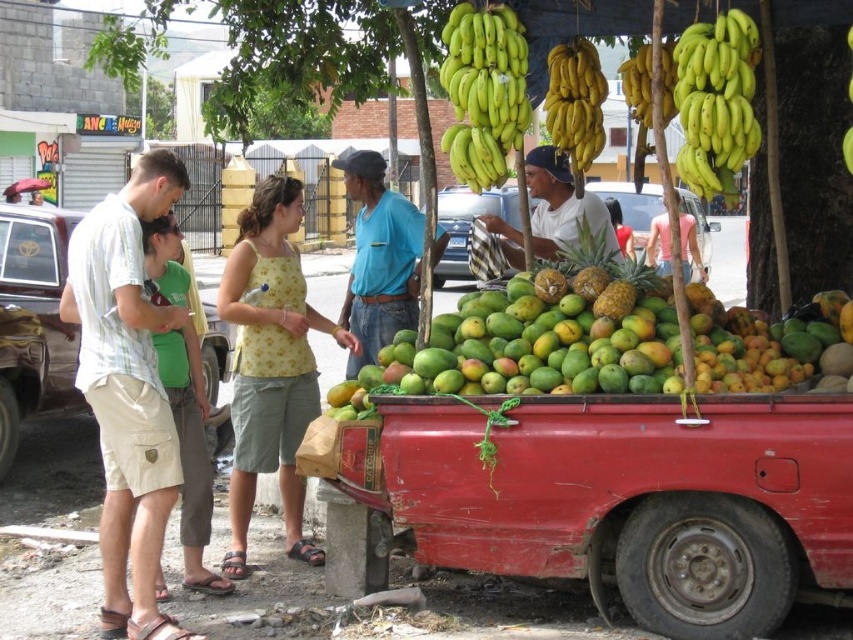
You are a customer at the fruit stand and want to grab both the yellow matte bananas at upper center and the green textured pineapple at center. Which one should you reach for first if you want to pick up the item that is closer to your right side?

The yellow matte bananas at upper center are to the left of the green textured pineapple at center, so the pineapple is closer to your right side. You should reach for the green textured pineapple at center first.

You are a customer at the fruit stand and want to buy a banana and a pineapple. Based on the image, which fruit is smaller in size between the yellow matte bananas at upper center and the green textured pineapple at center?

The yellow matte bananas at upper center has a smaller size compared to the green textured pineapple at center.